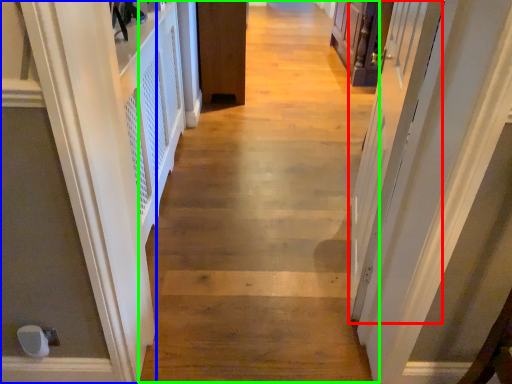
Question: Which is nearer to the screen door (highlighted by a red box)? door (highlighted by a blue box) or path (highlighted by a green box).

Choices:
 (A) door
 (B) path

Answer: (B)